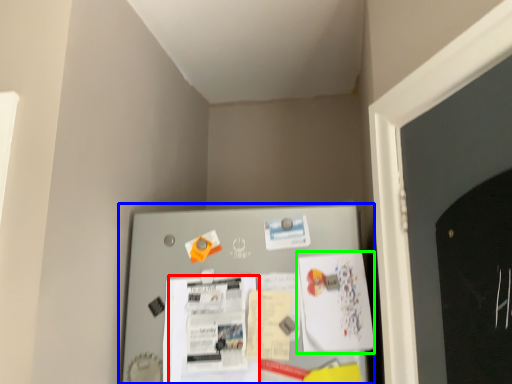
Question: Which object is positioned farthest from poster (highlighted by a red box)? Select from bulletin board (highlighted by a blue box) and poster (highlighted by a green box).

Choices:
 (A) bulletin board
 (B) poster

Answer: (B)